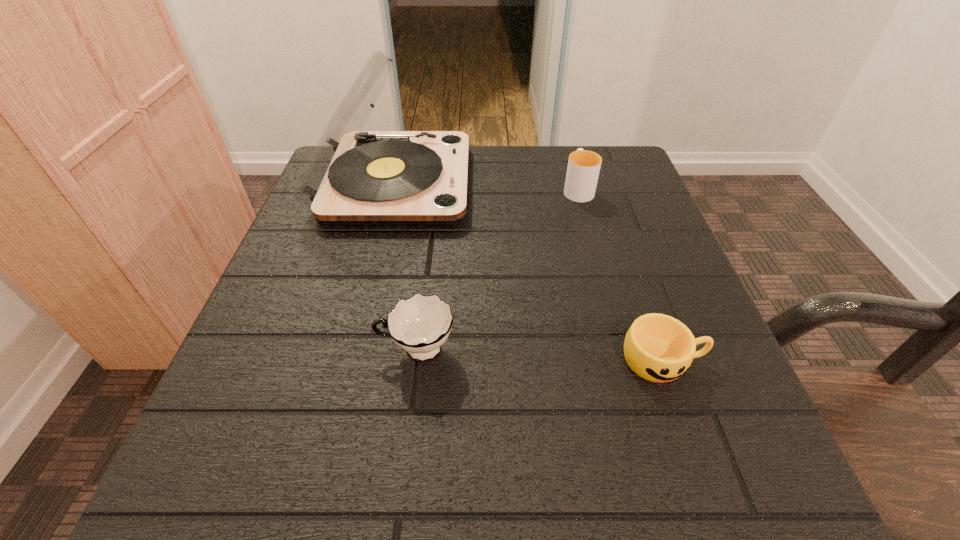
Where is `free space between the shortest object and the farthest cup`? The image size is (960, 540). free space between the shortest object and the farthest cup is located at coordinates (620, 274).

The width and height of the screenshot is (960, 540). Identify the location of free space between the leftmost cup and the shortest object. click(540, 355).

This screenshot has height=540, width=960. I want to click on vacant point located between the record player and the leftmost cup, so click(405, 266).

You are a GUI agent. You are given a task and a screenshot of the screen. Output one action in this format:
    pyautogui.click(x=<x>, y=<y>)
    Task: Click on the vacant space that's between the leftmost cup and the shortest cup
    The image size is (960, 540).
    Given the screenshot: What is the action you would take?
    pyautogui.click(x=540, y=355)

Find the location of a particular element. This screenshot has width=960, height=540. free space between the record player and the shortest object is located at coordinates (528, 272).

The height and width of the screenshot is (540, 960). I want to click on empty space that is in between the shortest cup and the record player, so click(x=528, y=272).

Identify the location of vacant space that's between the farthest cup and the leftmost cup. (497, 269).

The image size is (960, 540). What are the coordinates of `vacant area that lies between the shortest cup and the leftmost cup` in the screenshot? It's located at (540, 355).

This screenshot has height=540, width=960. What are the coordinates of `free point between the tallest object and the farthest cup` in the screenshot? It's located at (486, 186).

Choose which object is the nearest neighbor to the leftmost cup. Please provide its 2D coordinates. Your answer should be formatted as a tuple, i.e. [(x, y)], where the tuple contains the x and y coordinates of a point satisfying the conditions above.

[(353, 177)]